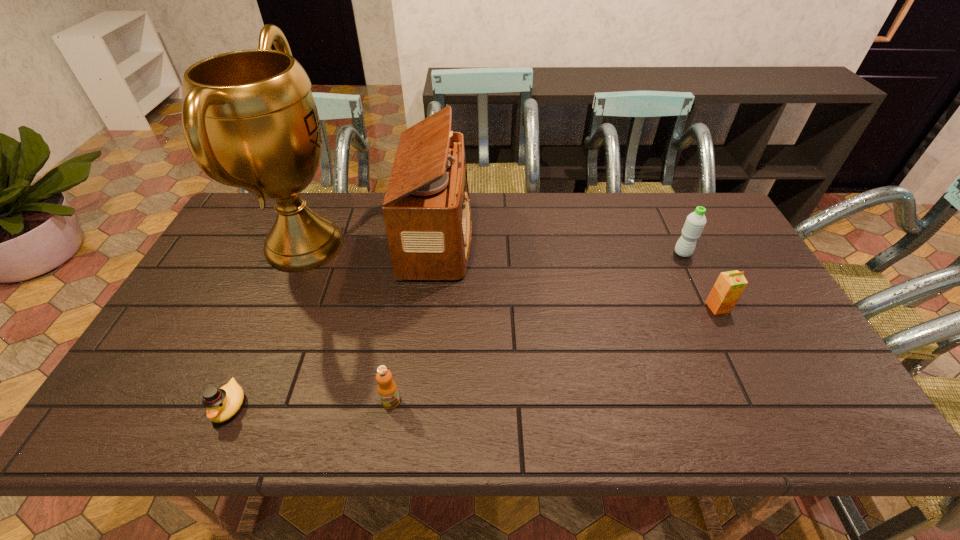
In order to click on vacant space at the right edge in this screenshot , I will do `click(776, 315)`.

In the image, there is a desktop. Where is `blank space at the far left corner`? blank space at the far left corner is located at coordinates (262, 228).

Identify the location of vacant space at the far right corner of the desktop. Image resolution: width=960 pixels, height=540 pixels. (721, 232).

Image resolution: width=960 pixels, height=540 pixels. Identify the location of free spot between the fourth shortest object and the duck. (456, 329).

The height and width of the screenshot is (540, 960). Find the location of `empty location between the second tallest object and the farther orange juice`. empty location between the second tallest object and the farther orange juice is located at coordinates [578, 272].

Locate an element on the screen. vacant region between the trophy cup and the farther orange juice is located at coordinates (512, 276).

Where is `free spot between the duck and the left orange juice`? The image size is (960, 540). free spot between the duck and the left orange juice is located at coordinates (310, 404).

Where is `vacant point located between the left orange juice and the right orange juice`? vacant point located between the left orange juice and the right orange juice is located at coordinates (554, 355).

The width and height of the screenshot is (960, 540). I want to click on free space that is in between the shortest object and the fifth shortest object, so click(x=334, y=322).

Find the location of a particular element. This screenshot has width=960, height=540. free space between the radio receiver and the shortest object is located at coordinates (334, 322).